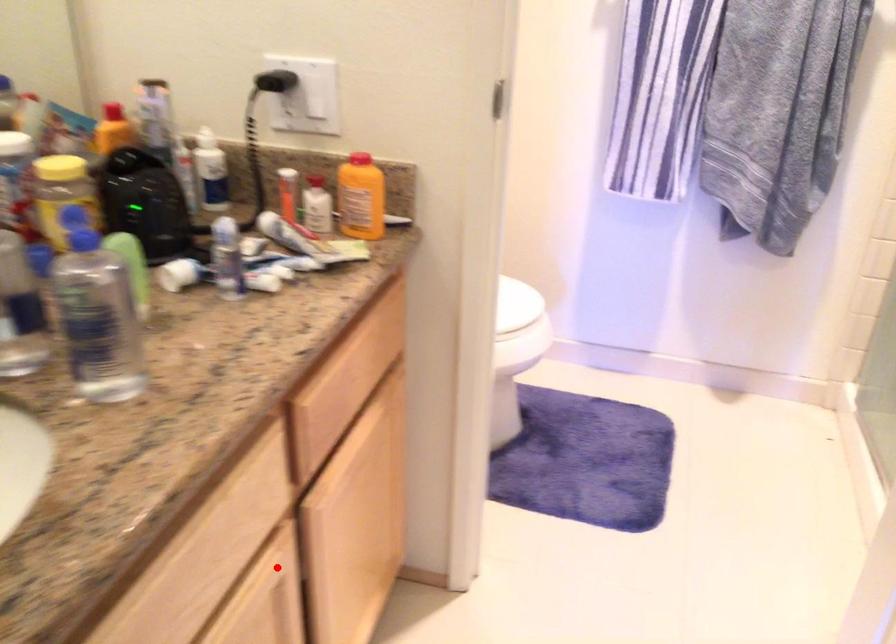
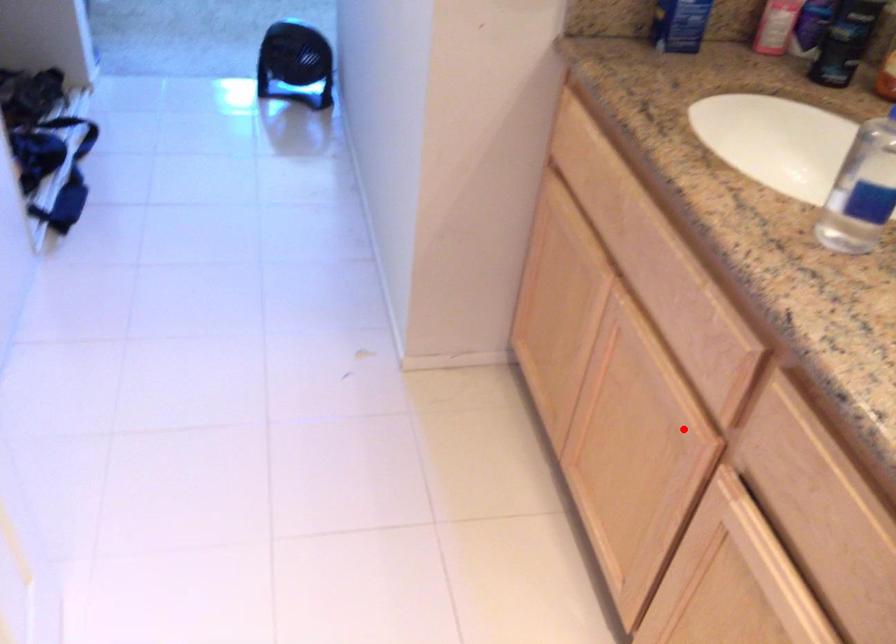
I am providing you with two images of the same scene from different viewpoints. A red point is marked on the first image and another point is marked on the second image. Does the point marked in image1 correspond to the same location as the one in image2?

Yes